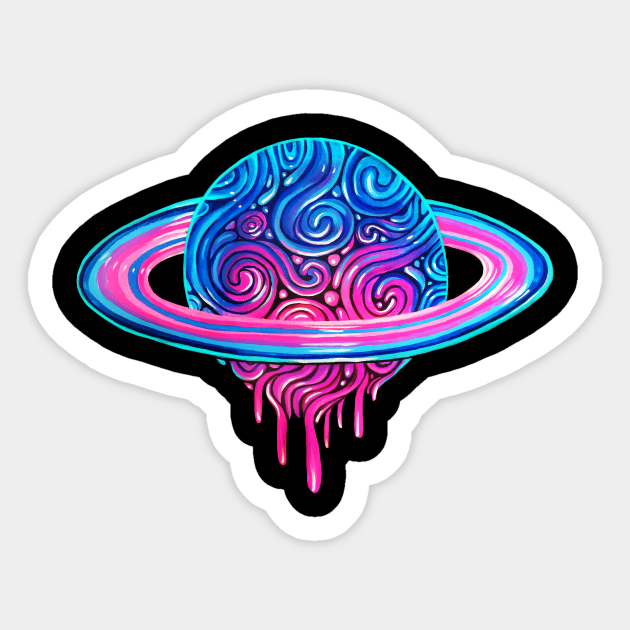
Where is `sticker`? The height and width of the screenshot is (630, 630). sticker is located at coordinates (301, 101).